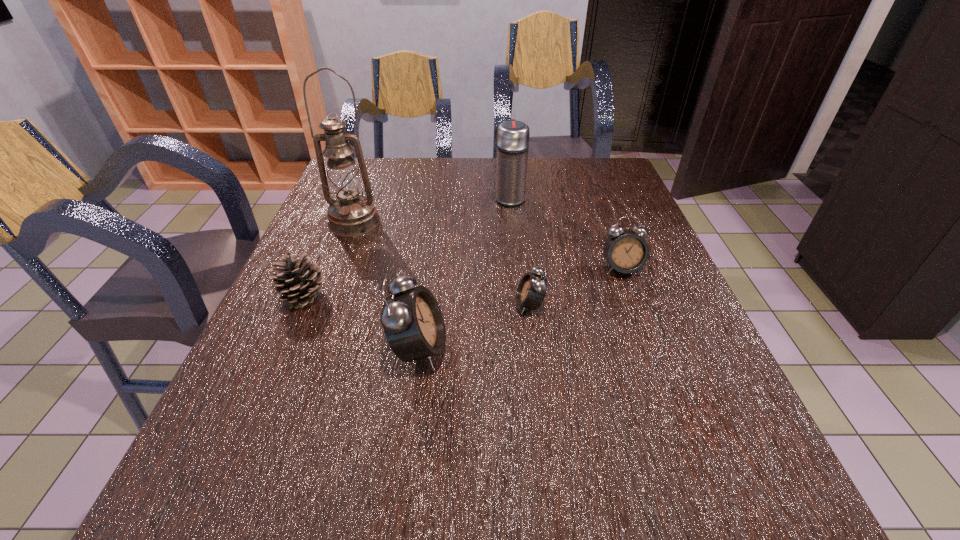
Find the location of a particular element. This screenshot has height=540, width=960. the nearest object is located at coordinates (412, 321).

Image resolution: width=960 pixels, height=540 pixels. What are the coordinates of `the fourth object from right to left` in the screenshot? It's located at (412, 321).

This screenshot has width=960, height=540. I want to click on the shortest alarm clock, so click(x=531, y=291).

This screenshot has width=960, height=540. What are the coordinates of `the second alarm clock from left to right` in the screenshot? It's located at (531, 291).

Identify the location of the farthest alarm clock. The height and width of the screenshot is (540, 960). pyautogui.click(x=627, y=252).

I want to click on the second shortest alarm clock, so (627, 252).

You are a GUI agent. You are given a task and a screenshot of the screen. Output one action in this format:
    pyautogui.click(x=<x>, y=<y>)
    Task: Click on the oil lamp
    
    Given the screenshot: What is the action you would take?
    351,214

What are the coordinates of `the tallest object` in the screenshot? It's located at (351, 214).

Find the location of a particular element. Image resolution: width=960 pixels, height=540 pixels. thermos bottle is located at coordinates (512, 136).

Find the location of `the fifth shortest object`. the fifth shortest object is located at coordinates (512, 136).